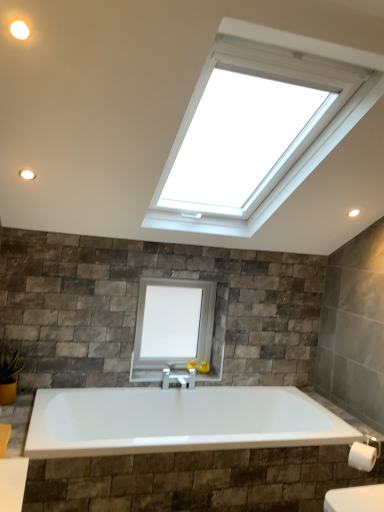
Question: Is white matte light fixture at upper left in front of or behind white matte toilet paper at lower right in the image?

Choices:
 (A) front
 (B) behind

Answer: (A)

Question: Is white matte light fixture at upper left taller or shorter than white matte toilet paper at lower right?

Choices:
 (A) tall
 (B) short

Answer: (B)

Question: Based on their relative distances, which object is farther from the green glossy plant at lower left?

Choices:
 (A) white matte toilet paper at lower right
 (B) white matte light fixture at upper left
 (C) matte white light fixture at upper left
 (D) white matte window at center

Answer: (A)

Question: Based on their relative distances, which object is nearer to the green glossy plant at lower left?

Choices:
 (A) white matte window at center
 (B) white matte toilet paper at lower right
 (C) white matte light fixture at upper left
 (D) matte white light fixture at upper left

Answer: (A)